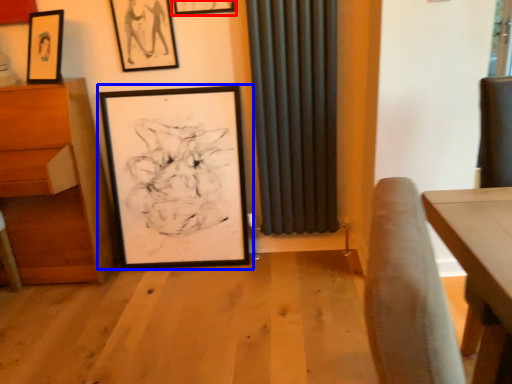
Question: Among these objects, which one is nearest to the camera, picture frame (highlighted by a red box) or picture frame (highlighted by a blue box)?

Choices:
 (A) picture frame
 (B) picture frame

Answer: (A)